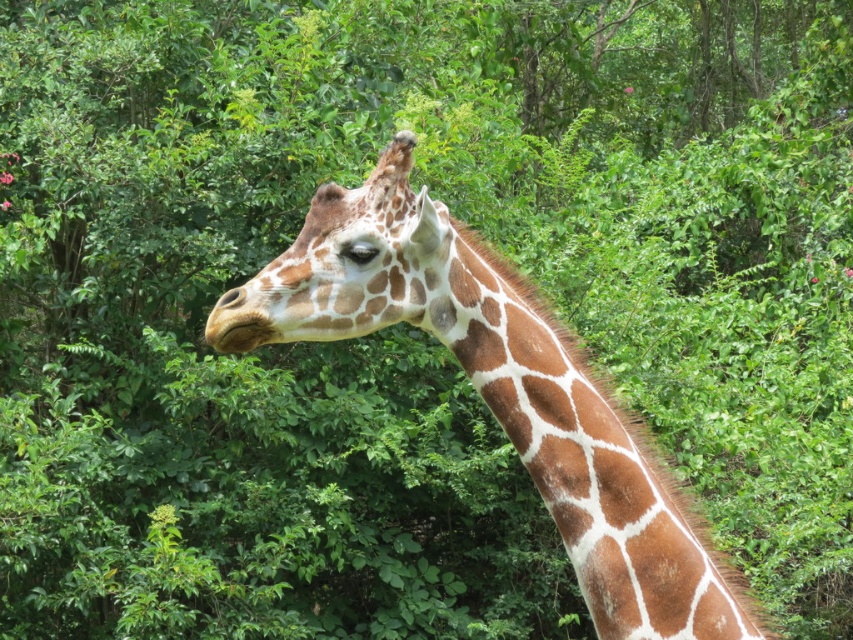
You are a wildlife photographer aiming to capture the giraffe in the image. You want to focus on the brown textured neck at center and the brown spotted skin at center. Which of these two features is taller?

The brown textured neck at center is taller than the brown spotted skin at center.